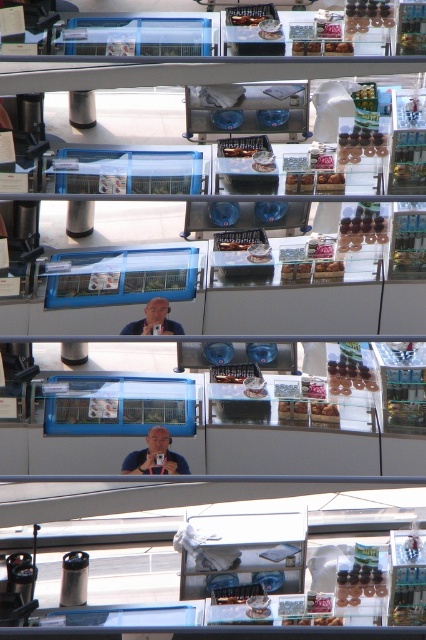
You are a photographer standing at the camera position. You want to take a photo of the smooth skin selfie at center. However, you notice that the subject is blurry. What might be the issue?

The smooth skin selfie at center is 51.02 meters away from camera, which is likely too far for a clear photo. The distance might cause the blur.

You are standing in front of the display case and want to take a photo of both the point at coordinates (167, 444) and the point at coordinates (155, 300). Which point will appear larger in your photo?

Point (167, 444) is closer to the camera than point (155, 300), so it will appear larger in the photo.

Looking at this image, you are a photographer trying to capture both the smooth skin selfie at center and the matte blue shirt at center in the same frame. Based on their positions, which one will appear larger in your photo?

The smooth skin selfie at center will appear larger in the photo because it is taller than the matte blue shirt at center.